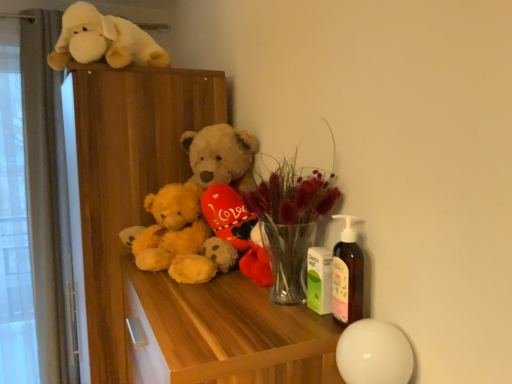
Question: Is translucent glass vase at center turned away from fluffy yellow teddy bear at center, the first teddy bear viewed from the right?

Choices:
 (A) yes
 (B) no

Answer: (B)

Question: From a real-world perspective, does translucent glass vase at center stand above fluffy yellow teddy bear at center, the first teddy bear viewed from the right?

Choices:
 (A) no
 (B) yes

Answer: (A)

Question: Is translucent glass vase at center in front of fluffy yellow teddy bear at center, the first teddy bear viewed from the right?

Choices:
 (A) yes
 (B) no

Answer: (A)

Question: Is translucent glass vase at center oriented towards fluffy yellow teddy bear at center, the first teddy bear viewed from the right?

Choices:
 (A) yes
 (B) no

Answer: (B)

Question: Is translucent glass vase at center not inside fluffy yellow teddy bear at center, the first teddy bear viewed from the right?

Choices:
 (A) no
 (B) yes

Answer: (B)

Question: In the image, is translucent glass vase at center positioned in front of or behind green matte lotion bottle at center, marked as the 2th toy in a left-to-right arrangement?

Choices:
 (A) behind
 (B) front

Answer: (B)

Question: Does point (310, 205) appear closer or farther from the camera than point (314, 261)?

Choices:
 (A) farther
 (B) closer

Answer: (B)

Question: In terms of width, does translucent glass vase at center look wider or thinner when compared to green matte lotion bottle at center, the 1th toy from the right?

Choices:
 (A) wide
 (B) thin

Answer: (A)

Question: From the image's perspective, relative to green matte lotion bottle at center, which is the first toy in front-to-back order, is translucent glass vase at center above or below?

Choices:
 (A) above
 (B) below

Answer: (A)

Question: In terms of width, does wooden dresser at upper left look wider or thinner when compared to wooden table at center?

Choices:
 (A) wide
 (B) thin

Answer: (A)

Question: Would you say wooden dresser at upper left is inside or outside wooden table at center?

Choices:
 (A) outside
 (B) inside

Answer: (A)

Question: Is wooden dresser at upper left taller or shorter than wooden table at center?

Choices:
 (A) tall
 (B) short

Answer: (A)

Question: From a real-world perspective, relative to wooden table at center, is wooden dresser at upper left vertically above or below?

Choices:
 (A) above
 (B) below

Answer: (A)

Question: Considering the positions of fluffy yellow teddy bear at center, the first teddy bear viewed from the right, and fluffy yellow teddy bear at center, the second teddy bear in the right-to-left sequence, in the image, is fluffy yellow teddy bear at center, the first teddy bear viewed from the right, bigger or smaller than fluffy yellow teddy bear at center, the second teddy bear in the right-to-left sequence,?

Choices:
 (A) big
 (B) small

Answer: (A)

Question: Considering the positions of fluffy yellow teddy bear at center, which appears as the 2th teddy bear when viewed from the left, and fluffy yellow teddy bear at center, the second teddy bear in the right-to-left sequence, in the image, is fluffy yellow teddy bear at center, which appears as the 2th teddy bear when viewed from the left, wider or thinner than fluffy yellow teddy bear at center, the second teddy bear in the right-to-left sequence,?

Choices:
 (A) wide
 (B) thin

Answer: (A)